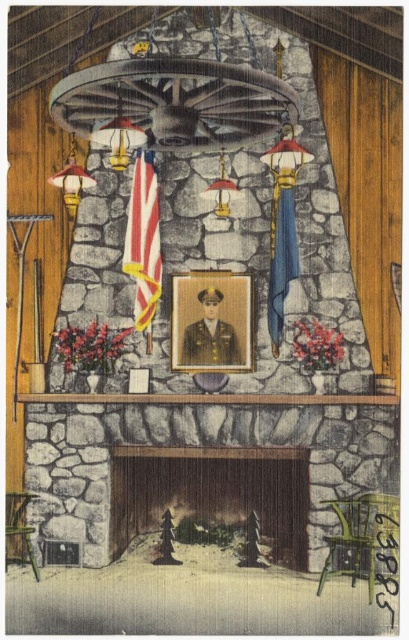
Question: Can you confirm if wooden fireplace at center is thinner than blue fabric flag at center-right?

Choices:
 (A) no
 (B) yes

Answer: (A)

Question: Is wooden fireplace at center positioned in front of matte glass lampshade at upper center?

Choices:
 (A) yes
 (B) no

Answer: (B)

Question: Which of these objects is positioned farthest from the matte glass lampshade at upper center?

Choices:
 (A) gold metallic frame at center
 (B) american flag at center

Answer: (A)

Question: Among these points, which one is farthest from the camera?

Choices:
 (A) (69, 401)
 (B) (130, 218)
 (C) (89, 138)
 (D) (83, 182)

Answer: (B)

Question: Is wooden fireplace at center thinner than american flag at center?

Choices:
 (A) yes
 (B) no

Answer: (B)

Question: Which is farther from the matte gold lamp at left?

Choices:
 (A) blue fabric flag at center-right
 (B) wooden fireplace at center
 (C) american flag at center
 (D) matte gold lamp at center

Answer: (B)